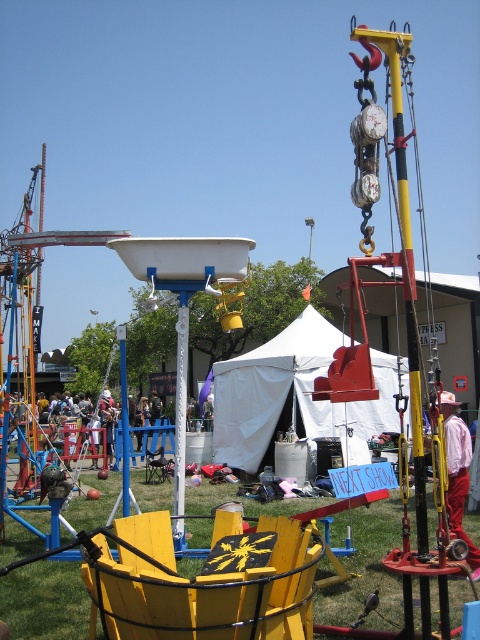
Which is behind, point (327, 324) or point (94, 497)?

Point (327, 324)

Is white fabric tent at center shorter than green grass at lower center?

No.

Is point (229, 362) closer to camera compared to point (51, 524)?

No.

Find the location of a particular element. This screenshot has width=480, height=640. white fabric tent at center is located at coordinates (291, 392).

Does point (362, 436) come closer to viewer compared to point (457, 404)?

No, (362, 436) is further to viewer.

Can you confirm if white fabric tent at center is positioned to the left of white cotton shirt at right?

Correct, you'll find white fabric tent at center to the left of white cotton shirt at right.

The image size is (480, 640). Describe the element at coordinates (291, 392) in the screenshot. I see `white fabric tent at center` at that location.

Locate an element on the screen. This screenshot has width=480, height=640. white fabric tent at center is located at coordinates (291, 392).

Is point (220, 518) closer to viewer compared to point (345, 576)?

Yes.

Is yellow painted wood chair at lower center positioned before green grass at lower center?

Yes, yellow painted wood chair at lower center is in front of green grass at lower center.

Between point (273, 636) and point (24, 524), which one is positioned in front?

Positioned in front is point (273, 636).

Locate an element on the screen. The image size is (480, 640). yellow painted wood chair at lower center is located at coordinates (205, 580).